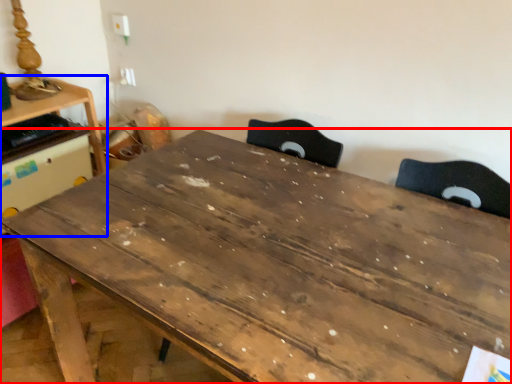
Question: Which object appears farthest to the camera in this image, table (highlighted by a red box) or table (highlighted by a blue box)?

Choices:
 (A) table
 (B) table

Answer: (B)